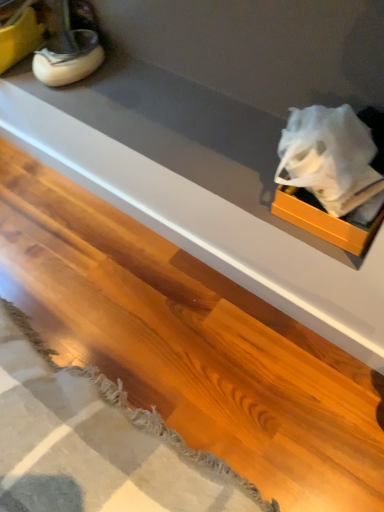
The height and width of the screenshot is (512, 384). What do you see at coordinates (324, 220) in the screenshot?
I see `orange matte box at upper right` at bounding box center [324, 220].

The width and height of the screenshot is (384, 512). What do you see at coordinates (68, 58) in the screenshot? I see `white rubber shoe at upper left` at bounding box center [68, 58].

The width and height of the screenshot is (384, 512). Identify the location of matte white counter at upper right. (199, 187).

Do you think matte white counter at upper right is within white rubber shoe at upper left, or outside of it?

matte white counter at upper right is outside white rubber shoe at upper left.

Which is more to the left, matte white counter at upper right or white rubber shoe at upper left?

white rubber shoe at upper left.

Is matte white counter at upper right oriented away from white rubber shoe at upper left?

No, matte white counter at upper right's orientation is not away from white rubber shoe at upper left.

Relative to white rubber shoe at upper left, is orange matte box at upper right in front or behind?

orange matte box at upper right is in front of white rubber shoe at upper left.

Between orange matte box at upper right and white rubber shoe at upper left, which one has smaller width?

Thinner between the two is white rubber shoe at upper left.

From a real-world perspective, is orange matte box at upper right above or below white rubber shoe at upper left?

orange matte box at upper right is above white rubber shoe at upper left.

In order to click on box located above the white rubber shoe at upper left (from a real-world perspective) in this screenshot , I will do `click(324, 220)`.

Considering the relative positions of matte white counter at upper right and orange matte box at upper right in the image provided, is matte white counter at upper right to the right of orange matte box at upper right from the viewer's perspective?

No.

What's the angular difference between matte white counter at upper right and orange matte box at upper right's facing directions?

There is a 0.00313-degree angle between the facing directions of matte white counter at upper right and orange matte box at upper right.

Find the location of a particular element. This screenshot has height=512, width=384. box lying on the right of matte white counter at upper right is located at coordinates (324, 220).

Measure the distance from matte white counter at upper right to orange matte box at upper right.

matte white counter at upper right and orange matte box at upper right are 11.80 inches apart.

Can you confirm if orange matte box at upper right is wider than matte white counter at upper right?

Yes, orange matte box at upper right is wider than matte white counter at upper right.

Does orange matte box at upper right touch matte white counter at upper right?

No, orange matte box at upper right is not beside matte white counter at upper right.

Would you say orange matte box at upper right is inside or outside matte white counter at upper right?

orange matte box at upper right is not inside matte white counter at upper right, it's outside.

Is white rubber shoe at upper left oriented towards matte white counter at upper right?

No, white rubber shoe at upper left is not turned towards matte white counter at upper right.

Looking at this image, considering the sizes of objects white rubber shoe at upper left and matte white counter at upper right in the image provided, who is wider, white rubber shoe at upper left or matte white counter at upper right?

Wider between the two is white rubber shoe at upper left.

Visually, is white rubber shoe at upper left positioned to the left or to the right of matte white counter at upper right?

white rubber shoe at upper left is positioned on matte white counter at upper right's left side.

Consider the image. Is white rubber shoe at upper left next to orange matte box at upper right?

No.

Measure the distance from white rubber shoe at upper left to orange matte box at upper right.

32.69 inches.

From the image's perspective, relative to orange matte box at upper right, is white rubber shoe at upper left above or below?

From the image's perspective, white rubber shoe at upper left appears above orange matte box at upper right.

Between point (83, 77) and point (274, 199), which one is positioned in front?

The point (274, 199) is closer to the camera.

You are a GUI agent. You are given a task and a screenshot of the screen. Output one action in this format:
    pyautogui.click(x=<x>, y=<y>)
    Task: Click on the counter top below the white rubber shoe at upper left (from a real-world perspective)
    This screenshot has width=384, height=512.
    Given the screenshot: What is the action you would take?
    pyautogui.click(x=199, y=187)

The width and height of the screenshot is (384, 512). What are the coordinates of `box below the white rubber shoe at upper left (from the image's perspective)` in the screenshot? It's located at (324, 220).

Which object lies further to the anchor point orange matte box at upper right, white rubber shoe at upper left or matte white counter at upper right?

The object further to orange matte box at upper right is white rubber shoe at upper left.

Looking at the image, which one is located further to white rubber shoe at upper left, orange matte box at upper right or matte white counter at upper right?

orange matte box at upper right is further to white rubber shoe at upper left.

Which object lies nearer to the anchor point orange matte box at upper right, matte white counter at upper right or white rubber shoe at upper left?

matte white counter at upper right is positioned closer to the anchor orange matte box at upper right.

From the image, which object appears to be farther from matte white counter at upper right, white rubber shoe at upper left or orange matte box at upper right?

The object further to matte white counter at upper right is white rubber shoe at upper left.

Looking at the image, which one is located closer to white rubber shoe at upper left, matte white counter at upper right or orange matte box at upper right?

Based on the image, matte white counter at upper right appears to be nearer to white rubber shoe at upper left.

Which object lies nearer to the anchor point matte white counter at upper right, orange matte box at upper right or white rubber shoe at upper left?

Among the two, orange matte box at upper right is located nearer to matte white counter at upper right.

Where is `counter top between white rubber shoe at upper left and orange matte box at upper right in the horizontal direction`? counter top between white rubber shoe at upper left and orange matte box at upper right in the horizontal direction is located at coordinates (199, 187).